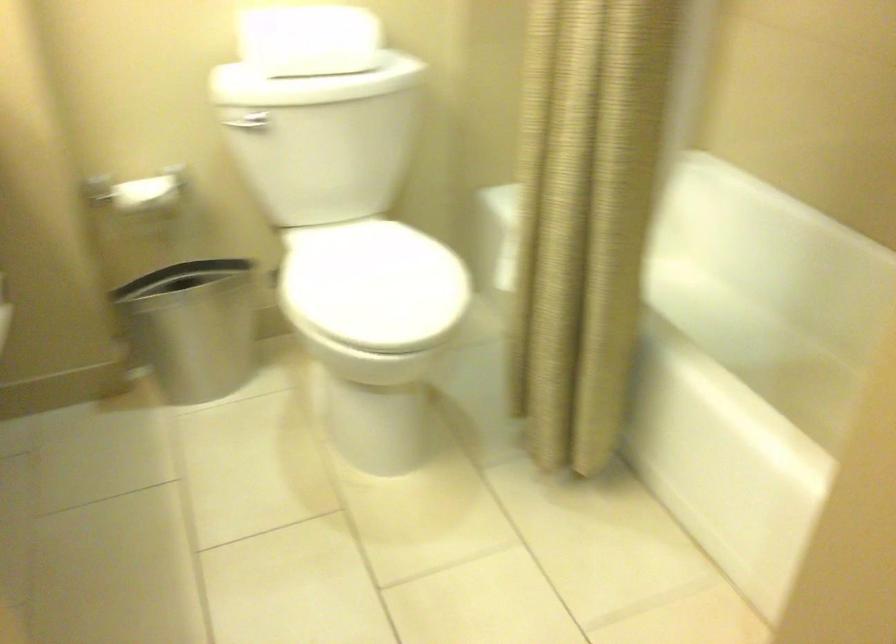
Find the location of a particular element. This screenshot has width=896, height=644. toilet flush lever is located at coordinates (247, 122).